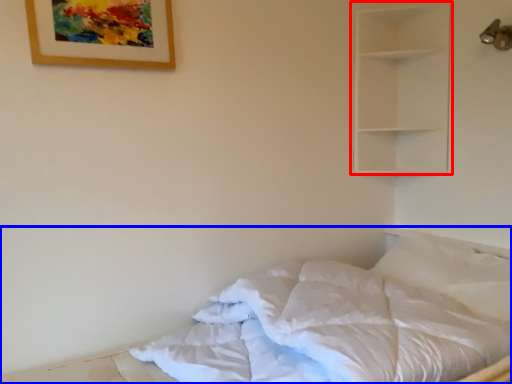
Question: Which object appears farthest to the camera in this image, shelf (highlighted by a red box) or bed (highlighted by a blue box)?

Choices:
 (A) shelf
 (B) bed

Answer: (A)